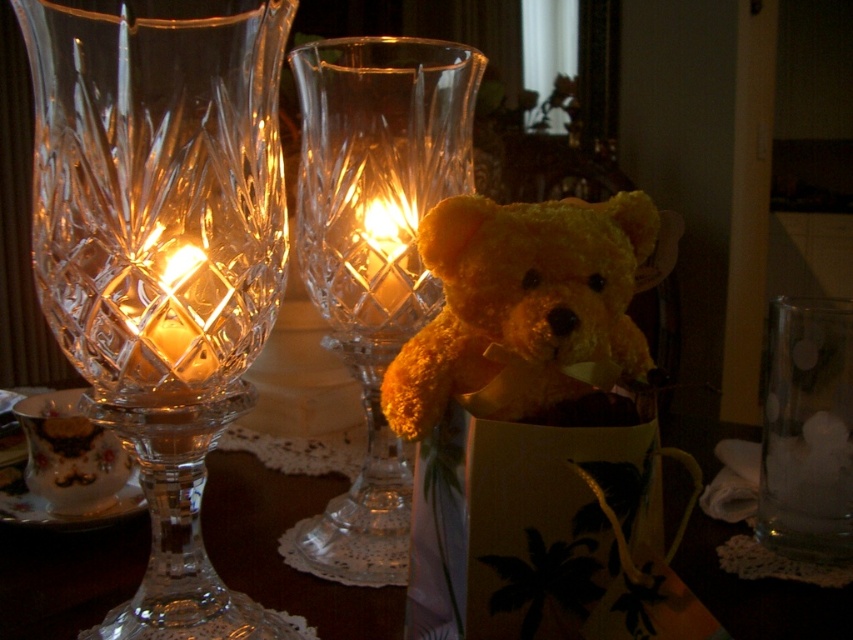
Question: Can you confirm if clear crystal vase at left is positioned to the right of yellow plush bear at center?

Choices:
 (A) no
 (B) yes

Answer: (A)

Question: Based on their relative distances, which object is nearer to the yellow plush bear at center?

Choices:
 (A) translucent glass candle at left
 (B) translucent glass candle at center

Answer: (A)

Question: Estimate the real-world distances between objects in this image. Which object is closer to the translucent glass candle at left?

Choices:
 (A) clear crystal wine glass at center
 (B) yellow plush bear at center

Answer: (B)

Question: Does translucent glass candle at left appear over translucent glass candle at center?

Choices:
 (A) yes
 (B) no

Answer: (B)

Question: Is translucent glass vase at center closer to the viewer compared to translucent glass candle at left?

Choices:
 (A) yes
 (B) no

Answer: (B)

Question: Which of the following is the farthest from the observer?

Choices:
 (A) translucent glass vase at center
 (B) yellow plush bear at center

Answer: (A)